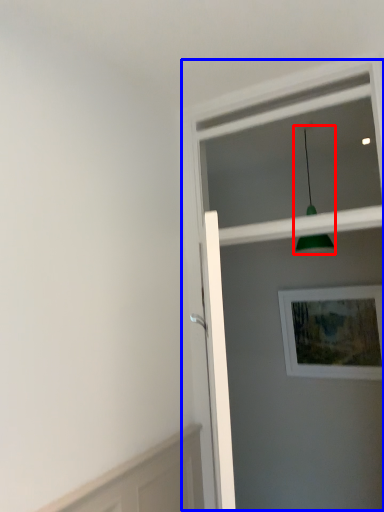
Question: Which point is closer to the camera, light fixture (highlighted by a red box) or screen door (highlighted by a blue box)?

Choices:
 (A) light fixture
 (B) screen door

Answer: (B)